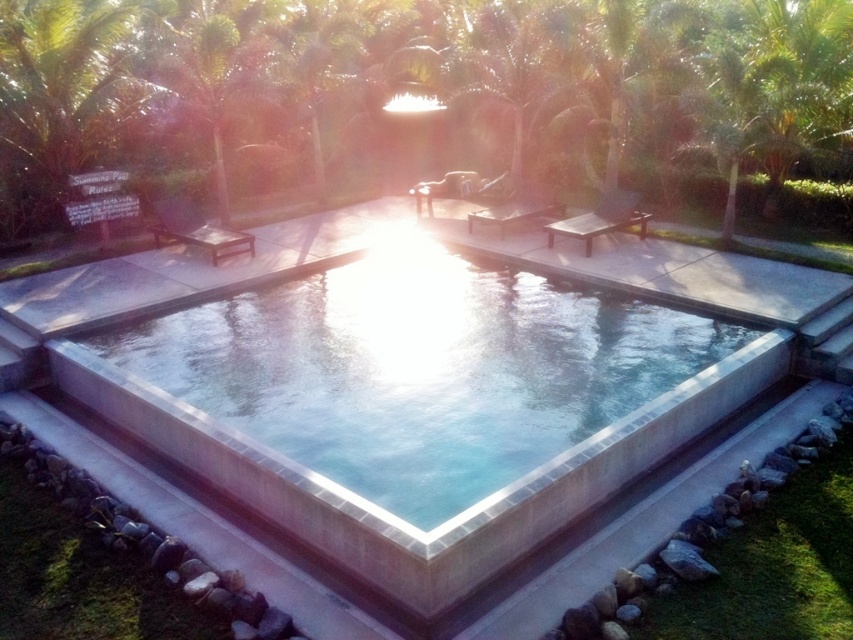
You are standing at the center of the rectangular swimming pool and looking towards the green leafy tree at upper center. Based on the coordinates provided, in which direction should you walk to reach the tree?

The green leafy tree at upper center is located at coordinates point (428, 99). Since you are at the center of the pool, you should walk towards the upper center direction to reach the tree.

You are planning to place a new rectangular table that is 2 meters wide between the smooth concrete pool at center and the matte brown lounge chair at center. Given their widths, will the table fit between them without overlapping?

The smooth concrete pool at center is thinner than the matte brown lounge chair at center. Since the table is 2 meters wide, and the pool is thinner than the lounge chair, we cannot determine the exact width of the space between them. Therefore, it is uncertain if the table will fit without overlapping.

From the picture: You are standing at point (180, 240) and want to walk towards the swimming pool in the image. Is the point (292, 316) blocking your path?

Point (292, 316) is in front of point (180, 240), so yes, the point (292, 316) is blocking your path to the swimming pool.